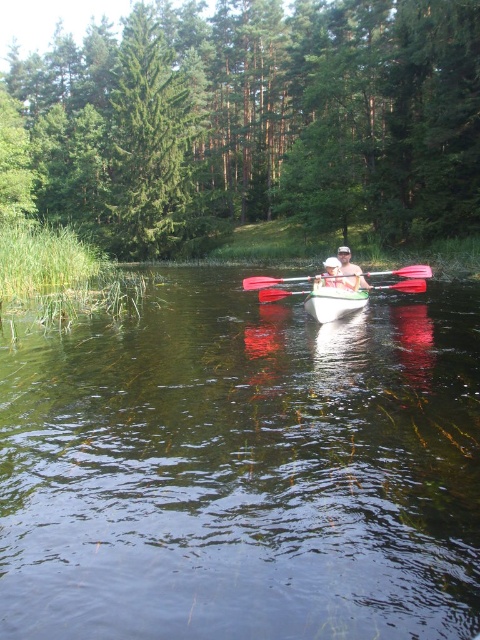
Question: Which of the following is the farthest from the observer?

Choices:
 (A) (408, 278)
 (B) (356, 292)

Answer: (A)

Question: Does green plastic kayak at center appear over white plastic canoe at center?

Choices:
 (A) yes
 (B) no

Answer: (B)

Question: Among these objects, which one is farthest from the camera?

Choices:
 (A) green glossy tree at upper left
 (B) green leafy tree at center
 (C) matte white kayak at center
 (D) red plastic paddle at center

Answer: (A)

Question: Does green plastic kayak at center lie in front of white plastic canoe at center?

Choices:
 (A) no
 (B) yes

Answer: (B)

Question: Does green glossy tree at upper left appear on the right side of white plastic canoe at center?

Choices:
 (A) yes
 (B) no

Answer: (B)

Question: Based on their relative distances, which object is nearer to the green glossy tree at upper left?

Choices:
 (A) matte white kayak at center
 (B) red plastic paddle at center

Answer: (A)